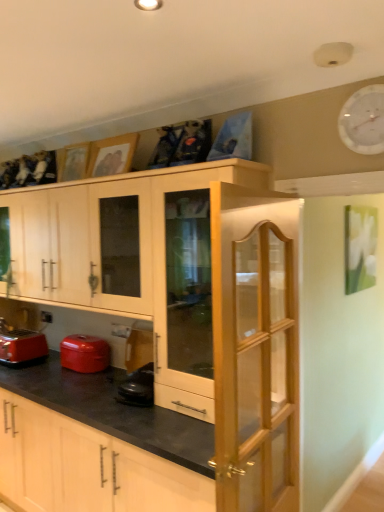
Question: Would you say light wood/glass cabinet door at center is to the left or to the right of wooden picture frame at upper left, the 2th picture frame when ordered from front to back, in the picture?

Choices:
 (A) right
 (B) left

Answer: (A)

Question: Considering the positions of light wood/glass cabinet door at center and wooden picture frame at upper left, placed as the first picture frame when sorted from back to front, in the image, is light wood/glass cabinet door at center wider or thinner than wooden picture frame at upper left, placed as the first picture frame when sorted from back to front,?

Choices:
 (A) wide
 (B) thin

Answer: (A)

Question: Estimate the real-world distances between objects in this image. Which object is farther from the wooden picture frame at upper center, the second picture frame in the left-to-right sequence?

Choices:
 (A) white glossy clock at upper right
 (B) wooden picture frame at upper left, which appears as the second picture frame when viewed from the right
 (C) matte red pot at lower left
 (D) light wood/glass cabinet door at center
 (E) matte wood cabinet at lower center

Answer: (A)

Question: Which is nearer to the matte red pot at lower left?

Choices:
 (A) white glossy clock at upper right
 (B) matte wood cabinet at lower center
 (C) light wood/glass cabinet door at center
 (D) wooden picture frame at upper center, the first picture frame from the front
 (E) matte red toaster at lower left

Answer: (E)